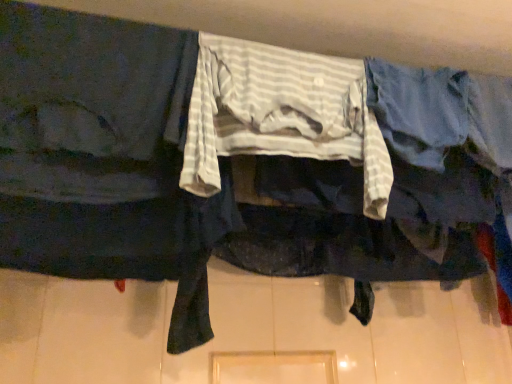
In order to click on white striped fabric at center in this screenshot , I will do `click(281, 114)`.

What do you see at coordinates (281, 114) in the screenshot?
I see `white striped fabric at center` at bounding box center [281, 114].

Measure the distance between white striped fabric at center and camera.

white striped fabric at center and camera are 26.90 inches apart.

What is the approximate height of white striped fabric at center?

It is 13.94 inches.

Describe the element at coordinates (104, 157) in the screenshot. This screenshot has height=384, width=512. I see `dark blue fabric at left` at that location.

What are the coordinates of `dark blue fabric at left` in the screenshot? It's located at (104, 157).

You are a GUI agent. You are given a task and a screenshot of the screen. Output one action in this format:
    pyautogui.click(x=<x>, y=<y>)
    Task: Click on the white striped fabric at center
    
    Given the screenshot: What is the action you would take?
    pyautogui.click(x=281, y=114)

Which object is positioned more to the right, dark blue fabric at left or white striped fabric at center?

Positioned to the right is white striped fabric at center.

Which is in front, dark blue fabric at left or white striped fabric at center?

dark blue fabric at left is in front.

Considering the points (45, 83) and (338, 154), which point is in front, point (45, 83) or point (338, 154)?

Positioned in front is point (45, 83).

From the image's perspective, is dark blue fabric at left below white striped fabric at center?

Yes, from the image's perspective, dark blue fabric at left is below white striped fabric at center.

From a real-world perspective, is dark blue fabric at left above or below white striped fabric at center?

Clearly, from a real-world perspective, dark blue fabric at left is below white striped fabric at center.

Between dark blue fabric at left and white striped fabric at center, which one has smaller width?

With smaller width is white striped fabric at center.

Is dark blue fabric at left taller than white striped fabric at center?

Yes.

Is dark blue fabric at left smaller than white striped fabric at center?

No, dark blue fabric at left is not smaller than white striped fabric at center.

Would you say dark blue fabric at left is inside or outside white striped fabric at center?

dark blue fabric at left lies outside white striped fabric at center.

Is dark blue fabric at left far away from white striped fabric at center?

That's not correct — dark blue fabric at left is a little close to white striped fabric at center.

Consider the image. Does dark blue fabric at left turn towards white striped fabric at center?

No, dark blue fabric at left is not turned towards white striped fabric at center.

How many degrees apart are the facing directions of dark blue fabric at left and white striped fabric at center?

They differ by 0.00264 degrees in their facing directions.

The width and height of the screenshot is (512, 384). I want to click on clothing above the dark blue fabric at left (from a real-world perspective), so (281, 114).

Which is more to the right, white striped fabric at center or dark blue fabric at left?

From the viewer's perspective, white striped fabric at center appears more on the right side.

Relative to dark blue fabric at left, is white striped fabric at center in front or behind?

white striped fabric at center is behind dark blue fabric at left.

Which point is more forward, (325, 74) or (18, 264)?

The point (18, 264) is in front.

From the image's perspective, is white striped fabric at center beneath dark blue fabric at left?

Incorrect, from the image's perspective, white striped fabric at center is higher than dark blue fabric at left.

From a real-world perspective, is white striped fabric at center over dark blue fabric at left?

Yes, from a real-world perspective, white striped fabric at center is over dark blue fabric at left

In terms of width, does white striped fabric at center look wider or thinner when compared to dark blue fabric at left?

white striped fabric at center is thinner than dark blue fabric at left.

Considering the sizes of objects white striped fabric at center and dark blue fabric at left in the image provided, who is shorter, white striped fabric at center or dark blue fabric at left?

With less height is white striped fabric at center.

Which of these two, white striped fabric at center or dark blue fabric at left, is smaller?

Smaller between the two is white striped fabric at center.

Is white striped fabric at center outside of dark blue fabric at left?

white striped fabric at center lies outside dark blue fabric at left's area.

Would you consider white striped fabric at center to be distant from dark blue fabric at left?

No, there isn't a large distance between white striped fabric at center and dark blue fabric at left.

Is white striped fabric at center oriented towards dark blue fabric at left?

No, white striped fabric at center does not turn towards dark blue fabric at left.

In order to click on robe on the left of white striped fabric at center in this screenshot , I will do `click(104, 157)`.

Where is `robe lying below the white striped fabric at center (from the image's perspective)`? Image resolution: width=512 pixels, height=384 pixels. robe lying below the white striped fabric at center (from the image's perspective) is located at coordinates (104, 157).

Find the location of `robe located in front of the white striped fabric at center`. robe located in front of the white striped fabric at center is located at coordinates (x=104, y=157).